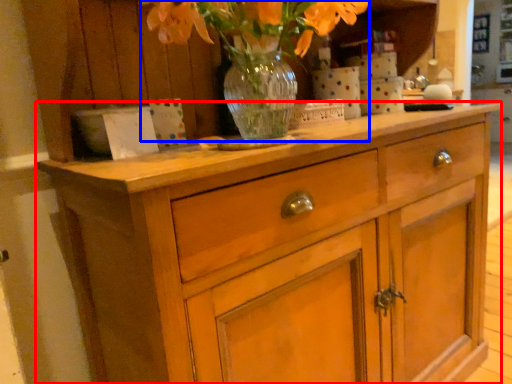
Question: Which object is closer to the camera taking this photo, chest of drawers (highlighted by a red box) or floral arrangement (highlighted by a blue box)?

Choices:
 (A) chest of drawers
 (B) floral arrangement

Answer: (A)